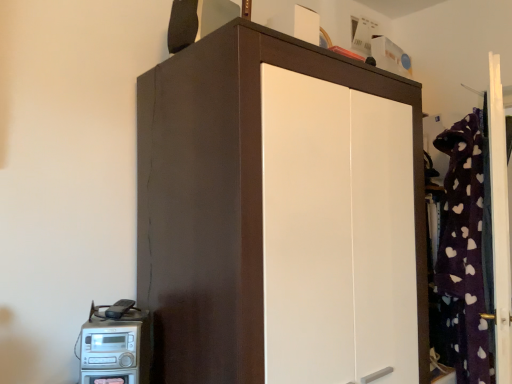
What do you see at coordinates (276, 206) in the screenshot? I see `matte brown cupboard at center` at bounding box center [276, 206].

Looking at this image, what is the approximate width of matte brown cupboard at center?

matte brown cupboard at center is 24.41 inches in width.

The image size is (512, 384). In order to click on matte brown cupboard at center in this screenshot , I will do `click(276, 206)`.

This screenshot has height=384, width=512. What are the coordinates of `satin silver radio at lower left` in the screenshot? It's located at (115, 347).

The width and height of the screenshot is (512, 384). Describe the element at coordinates (115, 347) in the screenshot. I see `satin silver radio at lower left` at that location.

Find the location of a particular element. The width and height of the screenshot is (512, 384). matte brown cupboard at center is located at coordinates (276, 206).

Based on their positions, is satin silver radio at lower left located to the left or right of matte brown cupboard at center?

In the image, satin silver radio at lower left appears on the left side of matte brown cupboard at center.

Is satin silver radio at lower left in front of matte brown cupboard at center?

Result: No, the depth of satin silver radio at lower left is greater than that of matte brown cupboard at center.

Between point (87, 333) and point (159, 252), which one is positioned behind?

The point (159, 252) is farther.

From the image's perspective, relative to matte brown cupboard at center, is satin silver radio at lower left above or below?

Based on their image positions, satin silver radio at lower left is located beneath matte brown cupboard at center.

From a real-world perspective, is satin silver radio at lower left located beneath matte brown cupboard at center?

Yes, from a real-world perspective, satin silver radio at lower left is below matte brown cupboard at center.

Does satin silver radio at lower left have a lesser width compared to matte brown cupboard at center?

Yes.

Does satin silver radio at lower left have a greater height compared to matte brown cupboard at center?

In fact, satin silver radio at lower left may be shorter than matte brown cupboard at center.

Is satin silver radio at lower left bigger than matte brown cupboard at center?

Actually, satin silver radio at lower left might be smaller than matte brown cupboard at center.

Would you say satin silver radio at lower left is outside matte brown cupboard at center?

Yes.

Can you see satin silver radio at lower left touching matte brown cupboard at center?

They are not placed beside each other.

Could you tell me if satin silver radio at lower left is facing matte brown cupboard at center?

No.

Where is `home appliance behind the matte brown cupboard at center`? home appliance behind the matte brown cupboard at center is located at coordinates (115, 347).

Would you say matte brown cupboard at center is to the left or to the right of satin silver radio at lower left in the picture?

matte brown cupboard at center is to the right of satin silver radio at lower left.

Which object is further away from the camera taking this photo, matte brown cupboard at center or satin silver radio at lower left?

satin silver radio at lower left is further away from the camera.

Considering the positions of point (335, 352) and point (150, 319), is point (335, 352) closer or farther from the camera than point (150, 319)?

Point (335, 352) is closer to the camera than point (150, 319).

From the picture: From the image's perspective, is matte brown cupboard at center above or below satin silver radio at lower left?

matte brown cupboard at center is above satin silver radio at lower left.

From a real-world perspective, which object rests below the other?

satin silver radio at lower left.

Which of these two, matte brown cupboard at center or satin silver radio at lower left, is thinner?

Thinner between the two is satin silver radio at lower left.

In terms of height, does matte brown cupboard at center look taller or shorter compared to satin silver radio at lower left?

Clearly, matte brown cupboard at center is taller compared to satin silver radio at lower left.

Between matte brown cupboard at center and satin silver radio at lower left, which one has smaller size?

satin silver radio at lower left.

Is matte brown cupboard at center located outside satin silver radio at lower left?

Absolutely, matte brown cupboard at center is external to satin silver radio at lower left.

Looking at this image, is matte brown cupboard at center in contact with satin silver radio at lower left?

matte brown cupboard at center and satin silver radio at lower left are not in contact.

Is matte brown cupboard at center positioned with its back to satin silver radio at lower left?

No, matte brown cupboard at center's orientation is not away from satin silver radio at lower left.

How many degrees apart are the facing directions of matte brown cupboard at center and satin silver radio at lower left?

32.1 degrees.

Locate an element on the screen. The image size is (512, 384). home appliance lying on the left of matte brown cupboard at center is located at coordinates (115, 347).

At what (x,y) coordinates should I click in order to perform the action: click on home appliance below the matte brown cupboard at center (from the image's perspective). Please return your answer as a coordinate pair (x, y). Looking at the image, I should click on (115, 347).

The image size is (512, 384). What are the coordinates of `cupboard above the satin silver radio at lower left (from the image's perspective)` in the screenshot? It's located at (276, 206).